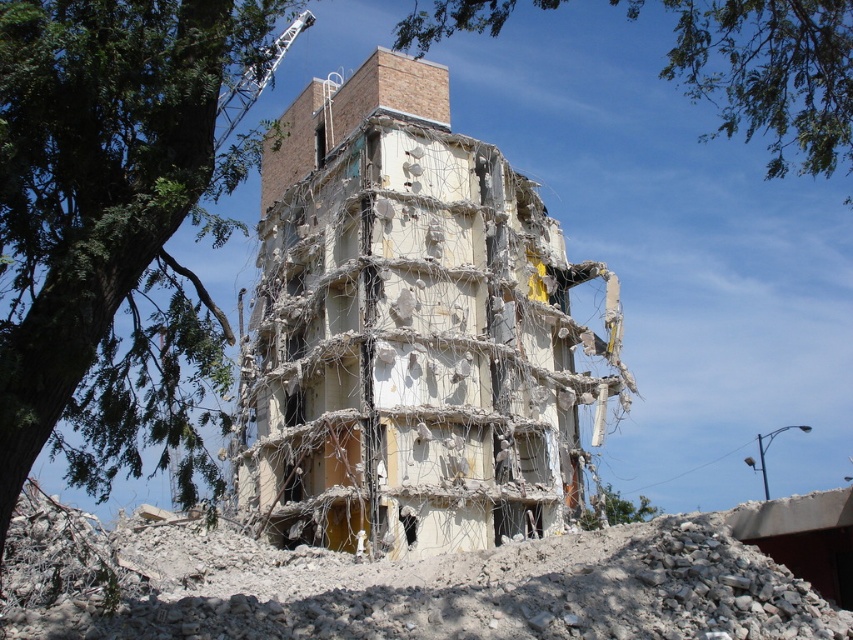
Which is behind, point (9, 221) or point (724, 67)?

The point (724, 67) is more distant.

Based on the photo, is green leafy tree at upper left smaller than green leafy tree at upper center?

Yes.

Does point (128, 340) lie in front of point (439, 4)?

That is False.

Locate an element on the screen. green leafy tree at upper left is located at coordinates (115, 220).

Does point (467, 221) lie behind point (96, 410)?

Yes, point (467, 221) is behind point (96, 410).

Is crumbled concrete building at center below green leafy tree at upper left?

No, crumbled concrete building at center is not below green leafy tree at upper left.

Where is `crumbled concrete building at center`? crumbled concrete building at center is located at coordinates (410, 330).

Image resolution: width=853 pixels, height=640 pixels. What are the coordinates of `crumbled concrete building at center` in the screenshot? It's located at (410, 330).

How much distance is there between crumbled concrete building at center and green leafy tree at upper center?

The distance of crumbled concrete building at center from green leafy tree at upper center is 95.52 feet.

Locate an element on the screen. The image size is (853, 640). crumbled concrete building at center is located at coordinates (410, 330).

Which is in front, point (473, 140) or point (691, 58)?

Point (691, 58) is in front.

Identify the location of crumbled concrete building at center. (410, 330).